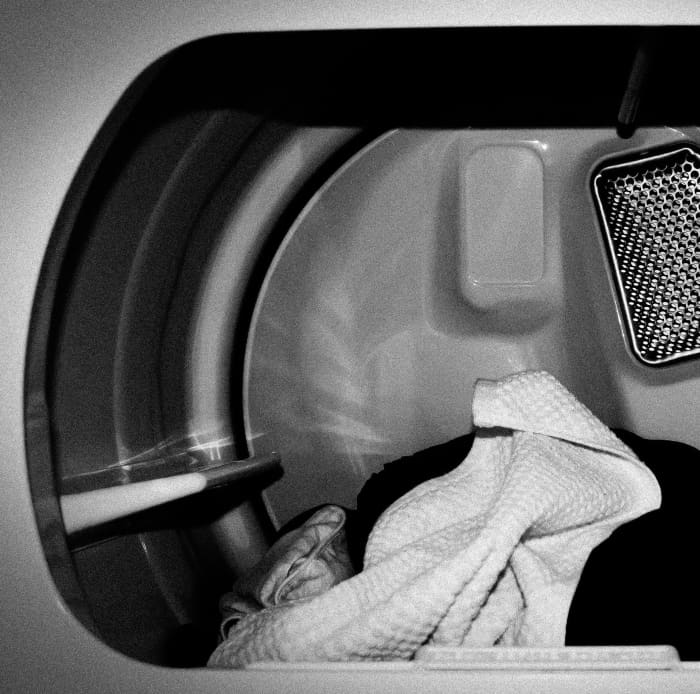
Locate an element on the screen. Image resolution: width=700 pixels, height=694 pixels. white fabric in dryer is located at coordinates (505, 573).